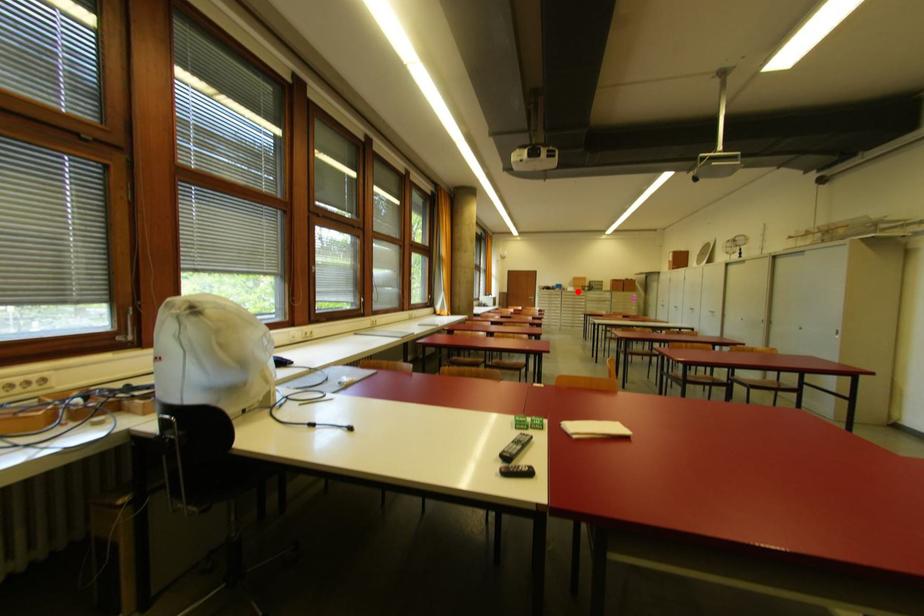
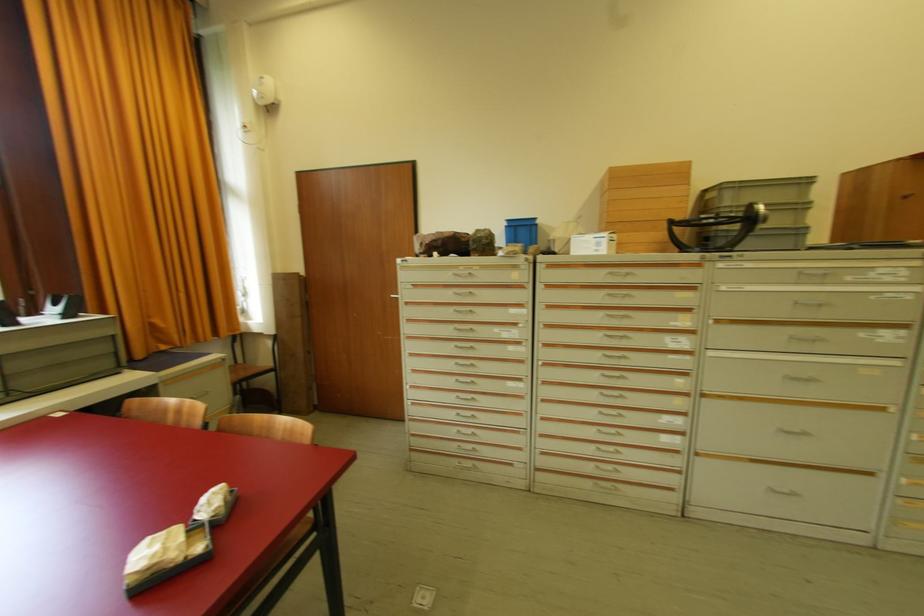
Where in the second image is the point corresponding to the highlighted location from the first image?

(623, 248)